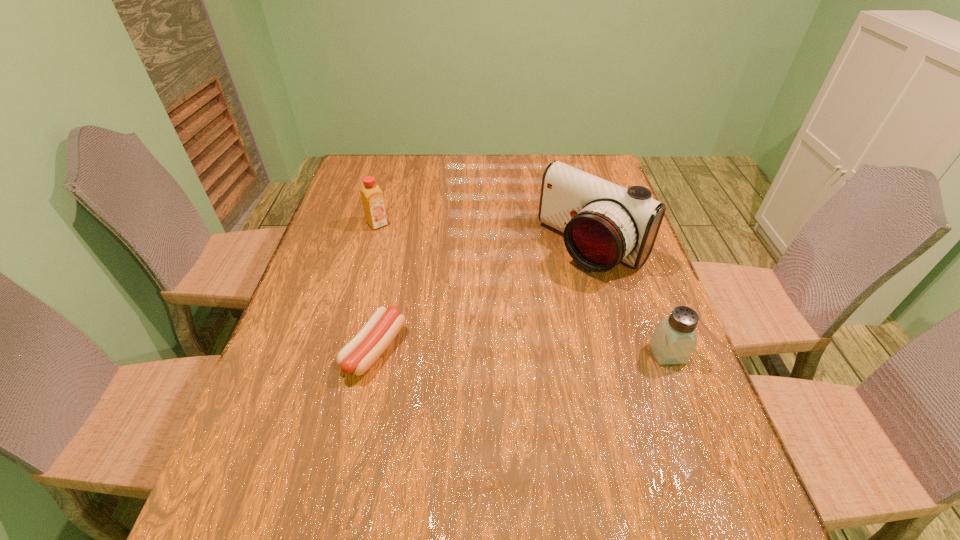
Image resolution: width=960 pixels, height=540 pixels. Find the location of `free point between the second shortest object and the shortest object`. free point between the second shortest object and the shortest object is located at coordinates (521, 351).

Find the location of a particular element. This screenshot has height=540, width=960. object that ranks as the closest to the third tallest object is located at coordinates (603, 223).

Where is `object that is the second closest one to the camcorder`? object that is the second closest one to the camcorder is located at coordinates (357, 356).

You are a GUI agent. You are given a task and a screenshot of the screen. Output one action in this format:
    pyautogui.click(x=<x>, y=<y>)
    Task: Click on the free space that satisfies the following two spatial constraints: 1. on the front side of the sausage; 2. on the right side of the orange juice
    This screenshot has width=960, height=540.
    Given the screenshot: What is the action you would take?
    [343, 349]